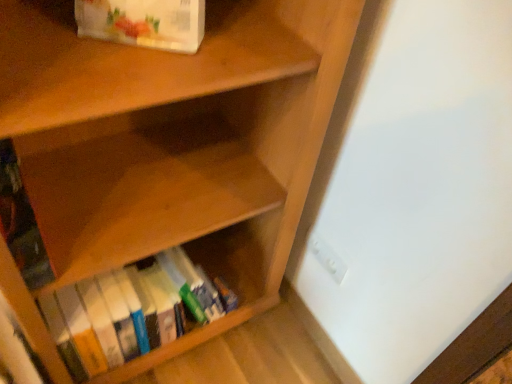
Question: Considering their positions, is white paper bag at upper left, acting as the 3th book starting from the bottom, located in front of or behind hardcover book at left, the second book ordered from the bottom?

Choices:
 (A) behind
 (B) front

Answer: (B)

Question: In terms of size, does white paper bag at upper left, acting as the 3th book starting from the bottom, appear bigger or smaller than hardcover book at left, positioned as the 2th book in top-to-bottom order?

Choices:
 (A) big
 (B) small

Answer: (A)

Question: Which is farther from the white plastic electric outlet at lower right?

Choices:
 (A) white paper bag at upper left, which is the first book in top-to-bottom order
 (B) hardcover book at left, positioned as the 2th book in top-to-bottom order
 (C) hardcover books at lower center, arranged as the first book when ordered from the bottom

Answer: (B)

Question: Which of these objects is positioned closest to the white paper bag at upper left, which is the first book in top-to-bottom order?

Choices:
 (A) hardcover book at left, positioned as the 2th book in top-to-bottom order
 (B) hardcover books at lower center, arranged as the third book when viewed from the top
 (C) white plastic electric outlet at lower right

Answer: (A)